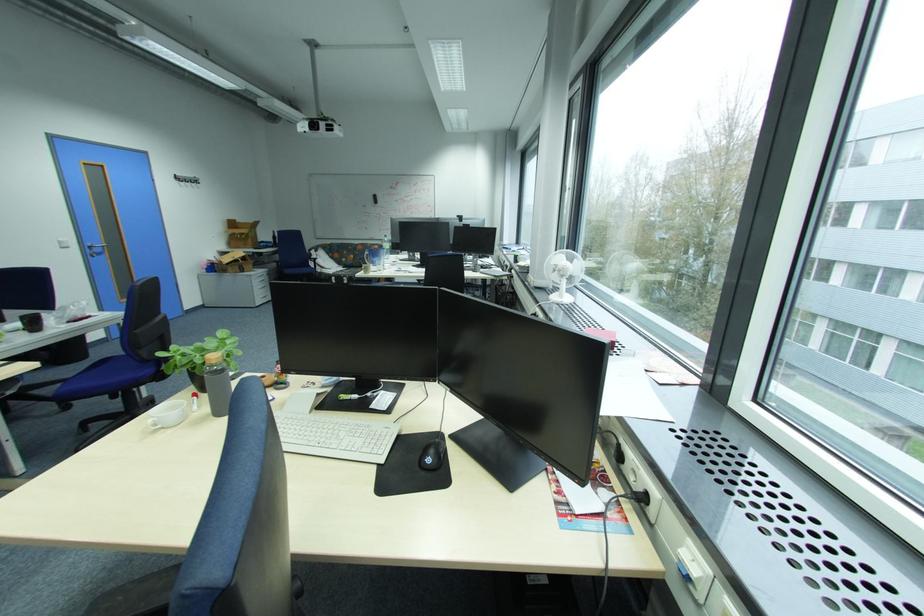
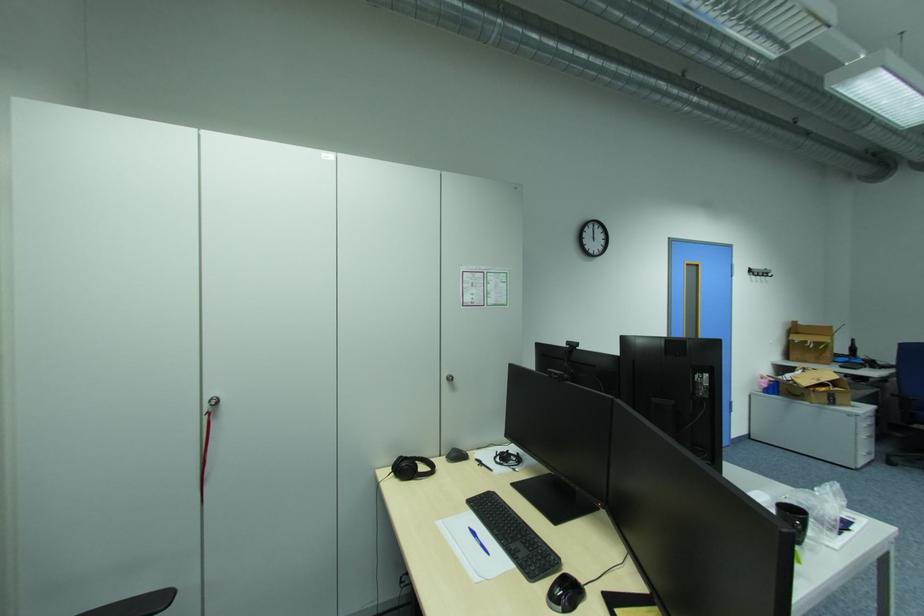
Where in the second image is the point corresponding to point (281, 241) from the first image?

(855, 354)